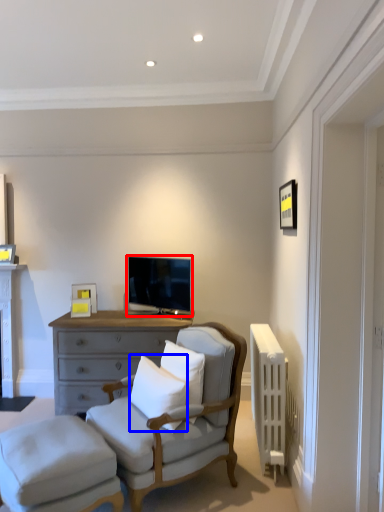
Question: Which point is closer to the camera, television (highlighted by a red box) or pillow (highlighted by a blue box)?

Choices:
 (A) television
 (B) pillow

Answer: (B)